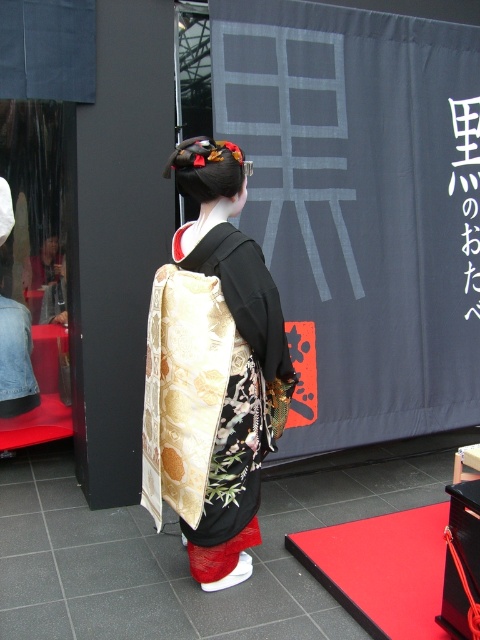
Question: Does silky gold kimono at center come behind black paper at upper center?

Choices:
 (A) yes
 (B) no

Answer: (B)

Question: Which object is positioned farthest from the black paper at upper center?

Choices:
 (A) silky gold kimono at center
 (B) red carpet at lower right

Answer: (A)

Question: Which of the following is the closest to the observer?

Choices:
 (A) (478, 134)
 (B) (425, 541)
 (C) (212, 256)

Answer: (C)

Question: Can you confirm if red carpet at lower right is positioned to the left of black paper at upper center?

Choices:
 (A) no
 (B) yes

Answer: (B)

Question: Which of the following is the closest to the observer?

Choices:
 (A) (155, 449)
 (B) (479, 301)

Answer: (A)

Question: Does silky gold kimono at center have a greater width compared to black paper at upper center?

Choices:
 (A) yes
 (B) no

Answer: (A)